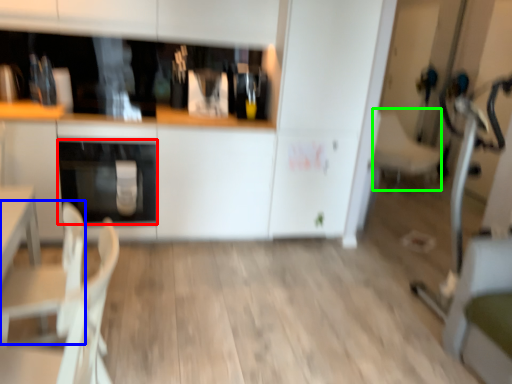
Question: Which is nearer to the oven (highlighted by a red box)? armchair (highlighted by a blue box) or armchair (highlighted by a green box).

Choices:
 (A) armchair
 (B) armchair

Answer: (A)